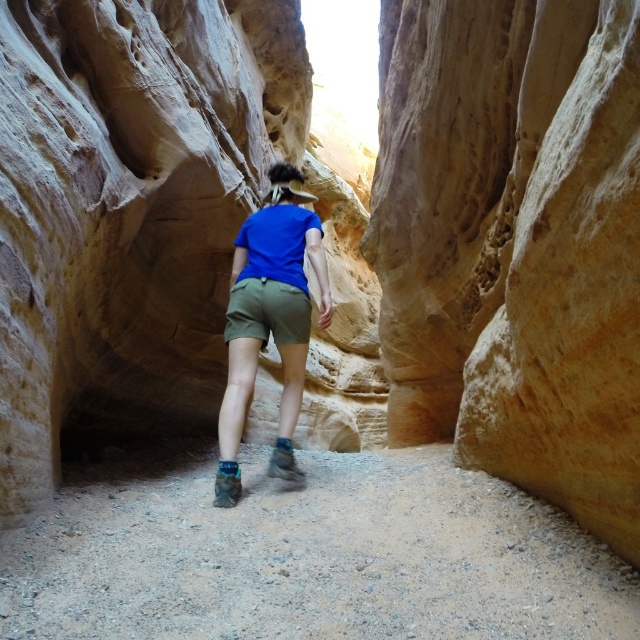
Question: In this image, where is dusty gravel trail at center located relative to khaki cotton shorts at center?

Choices:
 (A) above
 (B) below

Answer: (B)

Question: Which object is farther from the camera taking this photo?

Choices:
 (A) dusty gravel trail at center
 (B) khaki cotton shorts at center

Answer: (B)

Question: Does blue fabric shirt at center have a smaller size compared to khaki cotton shorts at center?

Choices:
 (A) no
 (B) yes

Answer: (B)

Question: Which object is the farthest from the dusty gravel trail at center?

Choices:
 (A) khaki cotton shorts at center
 (B) blue fabric shirt at center

Answer: (B)

Question: Which point is farther to the camera?

Choices:
 (A) (227, 307)
 (B) (230, 436)
 (C) (344, 616)

Answer: (A)

Question: Is dusty gravel trail at center positioned behind blue fabric shirt at center?

Choices:
 (A) yes
 (B) no

Answer: (B)